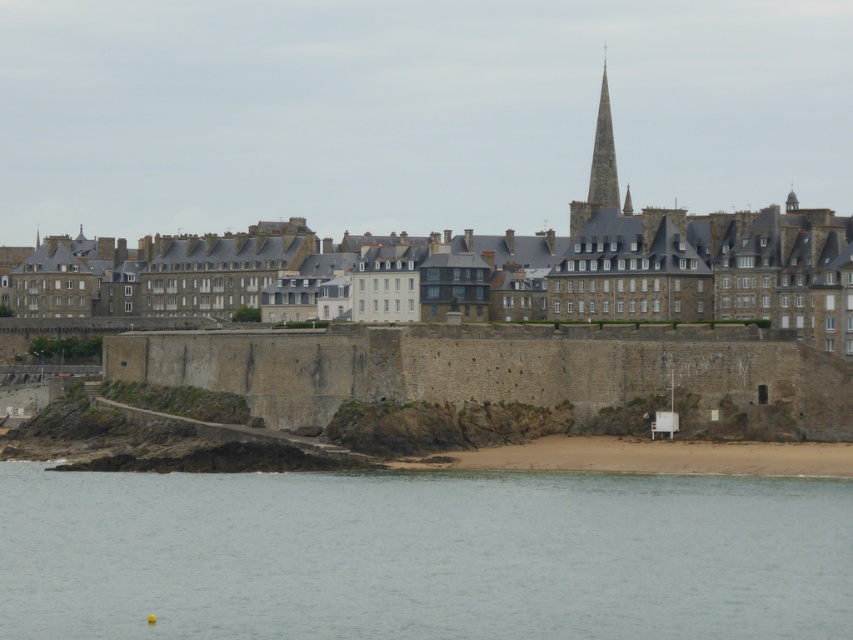
Question: Which of the following is the closest to the observer?

Choices:
 (A) coord(744,216)
 (B) coord(602,67)

Answer: (A)

Question: Observing the image, what is the correct spatial positioning of clear water at lower center in reference to smooth stone spire at center?

Choices:
 (A) below
 (B) above

Answer: (A)

Question: Which point appears closest to the camera in this image?

Choices:
 (A) (160, 236)
 (B) (573, 624)

Answer: (B)

Question: Which of the following is the closest to the observer?

Choices:
 (A) stone wall at center
 (B) smooth stone spire at center
 (C) clear water at lower center

Answer: (C)

Question: Is clear water at lower center smaller than stone wall at center?

Choices:
 (A) no
 (B) yes

Answer: (B)

Question: Can you confirm if clear water at lower center is positioned above stone wall at center?

Choices:
 (A) yes
 (B) no

Answer: (B)